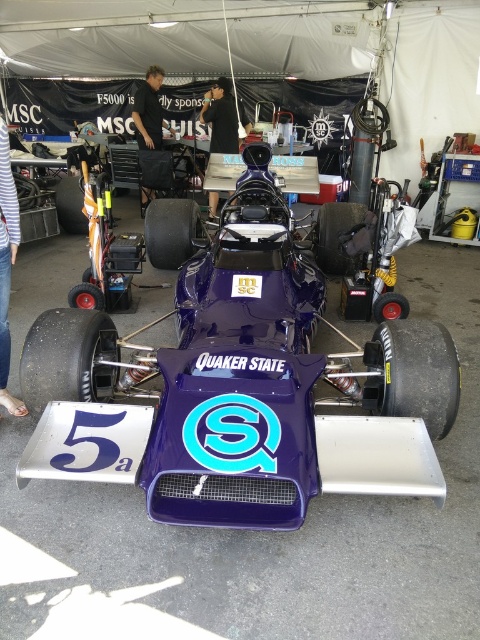
Who is higher up, purple glossy race car at center or striped fabric pants at lower left?

striped fabric pants at lower left

Can you confirm if purple glossy race car at center is positioned to the right of striped fabric pants at lower left?

Indeed, purple glossy race car at center is positioned on the right side of striped fabric pants at lower left.

Is point (210, 269) more distant than point (11, 237)?

Yes, point (210, 269) is farther from viewer.

The height and width of the screenshot is (640, 480). I want to click on purple glossy race car at center, so click(x=244, y=372).

Does striped fabric pants at lower left have a lesser height compared to black fabric at center?

No.

Does point (16, 205) come behind point (230, 150)?

No, (16, 205) is closer to viewer.

Is point (6, 140) less distant than point (232, 104)?

Yes, point (6, 140) is closer to viewer.

Where is `striped fabric pants at lower left`? striped fabric pants at lower left is located at coordinates (7, 266).

Which is above, purple glossy race car at center or black fabric shirt at upper center?

black fabric shirt at upper center is above.

Between purple glossy race car at center and black fabric shirt at upper center, which one appears on the left side from the viewer's perspective?

black fabric shirt at upper center

Is point (240, 264) behind point (162, 115)?

No, it is in front of (162, 115).

I want to click on purple glossy race car at center, so click(x=244, y=372).